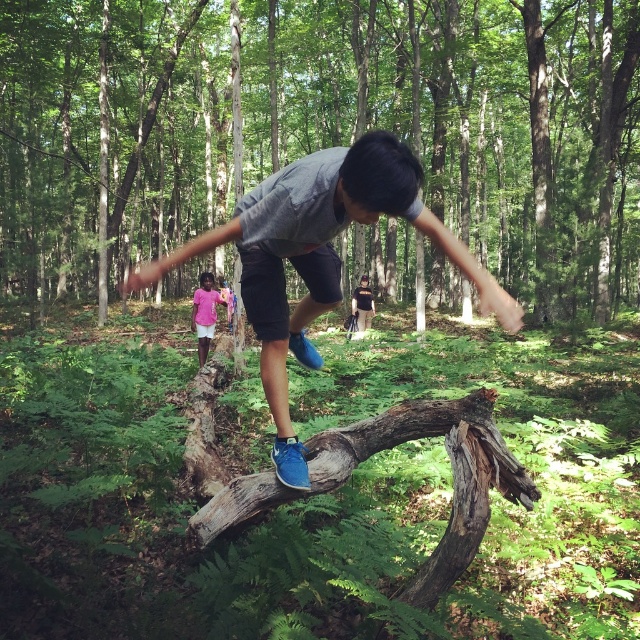
You are a hiker trying to cross a narrow log in the forest. You have your blue suede sneakers at center and a dark brown leather backpack at center. Which item is closer to the ground?

The blue suede sneakers at center is shorter than the dark brown leather backpack at center, so the blue suede sneakers at center is closer to the ground.

Looking at this image, you are standing in the forest and see two points marked in the image. Which point is closer to you, point (291, 321) or point (205, 301)?

Point (291, 321) is closer to the camera than point (205, 301).